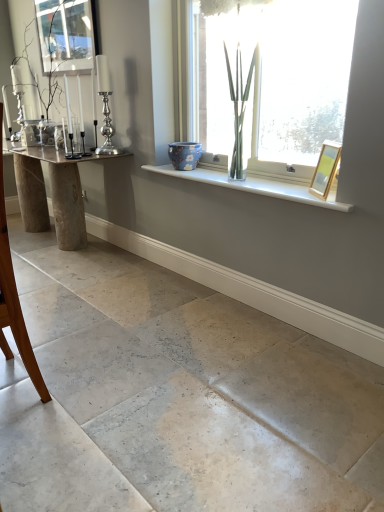
Question: Can you confirm if brown wooden chair at left is smaller than wooden picture frame at upper right?

Choices:
 (A) no
 (B) yes

Answer: (A)

Question: From a real-world perspective, is brown wooden chair at left positioned over wooden picture frame at upper right based on gravity?

Choices:
 (A) yes
 (B) no

Answer: (B)

Question: Does brown wooden chair at left contain wooden picture frame at upper right?

Choices:
 (A) yes
 (B) no

Answer: (B)

Question: Could you tell me if brown wooden chair at left is turned towards wooden picture frame at upper right?

Choices:
 (A) no
 (B) yes

Answer: (A)

Question: Does brown wooden chair at left appear on the left side of wooden picture frame at upper right?

Choices:
 (A) no
 (B) yes

Answer: (B)

Question: Looking at their shapes, would you say wooden picture frame at upper right is wider or thinner than brown wooden chair at left?

Choices:
 (A) thin
 (B) wide

Answer: (A)

Question: Visually, is wooden picture frame at upper right positioned to the left or to the right of brown wooden chair at left?

Choices:
 (A) left
 (B) right

Answer: (B)

Question: Considering the positions of point (324, 172) and point (31, 369), is point (324, 172) closer or farther from the camera than point (31, 369)?

Choices:
 (A) farther
 (B) closer

Answer: (A)

Question: From a real-world perspective, relative to brown wooden chair at left, is wooden picture frame at upper right vertically above or below?

Choices:
 (A) above
 (B) below

Answer: (A)

Question: Does point click(296, 175) appear closer or farther from the camera than point click(205, 166)?

Choices:
 (A) closer
 (B) farther

Answer: (A)

Question: From the image's perspective, is transparent glass vase at upper center positioned above or below white glossy window sill at upper center?

Choices:
 (A) above
 (B) below

Answer: (A)

Question: Is transparent glass vase at upper center in front of or behind white glossy window sill at upper center in the image?

Choices:
 (A) front
 (B) behind

Answer: (A)

Question: From a real-world perspective, is transparent glass vase at upper center above or below white glossy window sill at upper center?

Choices:
 (A) above
 (B) below

Answer: (A)

Question: Is point (190, 180) positioned closer to the camera than point (9, 293)?

Choices:
 (A) closer
 (B) farther

Answer: (B)

Question: Considering the positions of white glossy window sill at upper center and brown wooden chair at left in the image, is white glossy window sill at upper center wider or thinner than brown wooden chair at left?

Choices:
 (A) thin
 (B) wide

Answer: (B)